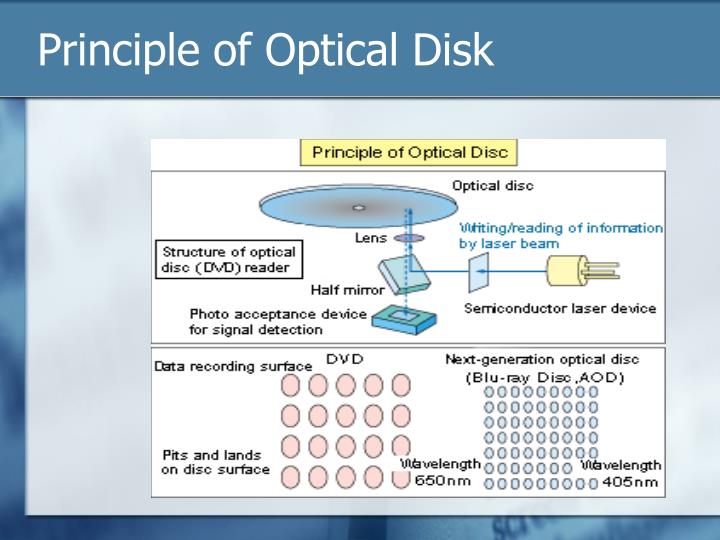
You are a GUI agent. You are given a task and a screenshot of the screen. Output one action in this format:
    pyautogui.click(x=<x>, y=<y>)
    Task: Click on the dvd
    
    Given the screenshot: What is the action you would take?
    pyautogui.click(x=342, y=364)